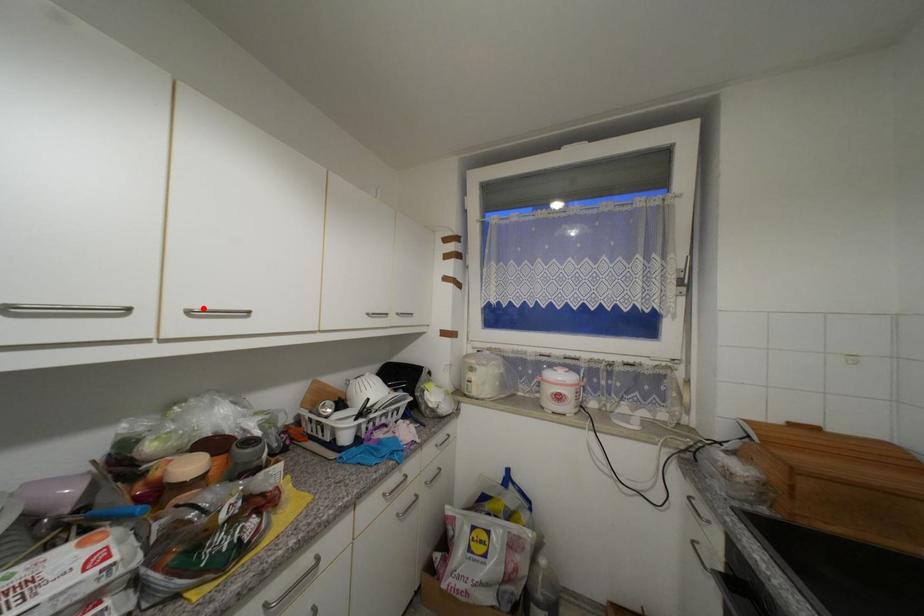
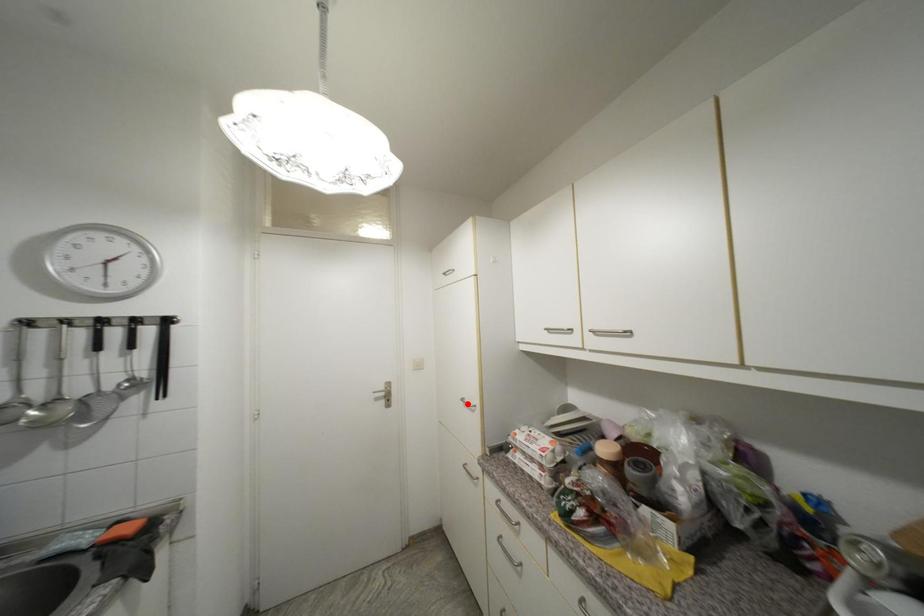
I am providing you with two images of the same scene from different viewpoints. A red point is marked on the first image and another point is marked on the second image. Is the red point in image1 aligned with the point shown in image2?

No